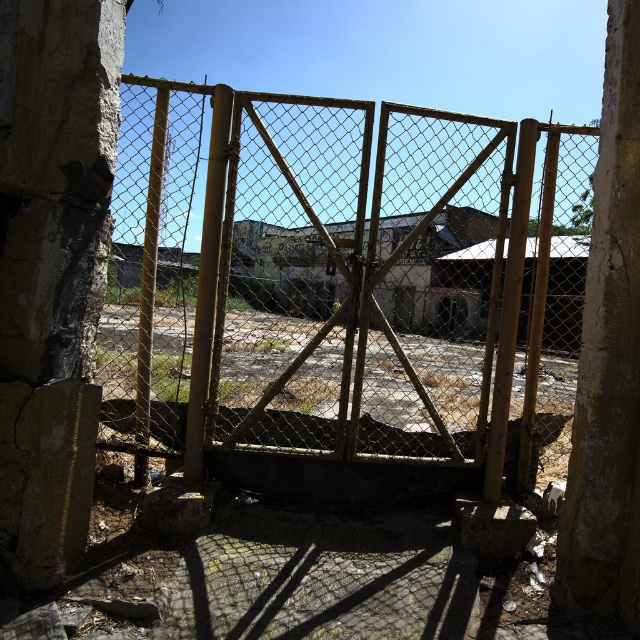
You are a delivery person with a cart that is 10 meters long. You need to navigate through the yellow wire mesh gate at center and around the cracked concrete pillar at right. Can your cart fit through the space between them?

The yellow wire mesh gate at center and cracked concrete pillar at right are 9.16 meters apart from each other. Since your cart is 10 meters long, it cannot fit through the space between them as the distance is shorter than the cart length.

You are a delivery person trying to enter through the yellow wire mesh gate at center. You notice a cracked concrete pillar at left nearby. Based on the scene, which object is closer to your current position when you are standing outside the gate?

The cracked concrete pillar at left is closer to your current position because the yellow wire mesh gate at center is positioned on the right side of it, implying the pillar is between you and the gate.

You are a construction inspector evaluating the stability of the cracked concrete pillars. Which pillar, the cracked concrete pillar at left or the cracked concrete pillar at right, has a greater potential for structural issues due to its size?

The cracked concrete pillar at left has a larger size compared to the cracked concrete pillar at right. Since larger pillars typically bear more weight, the cracked concrete pillar at left may have greater potential for structural issues due to its size and the existing cracks.